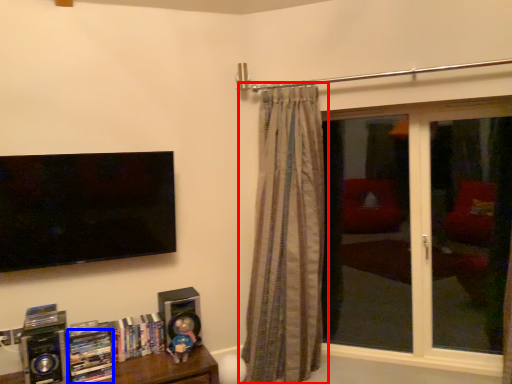
Question: Which of the following is the closest to the observer, curtain (highlighted by a red box) or book (highlighted by a blue box)?

Choices:
 (A) curtain
 (B) book

Answer: (B)